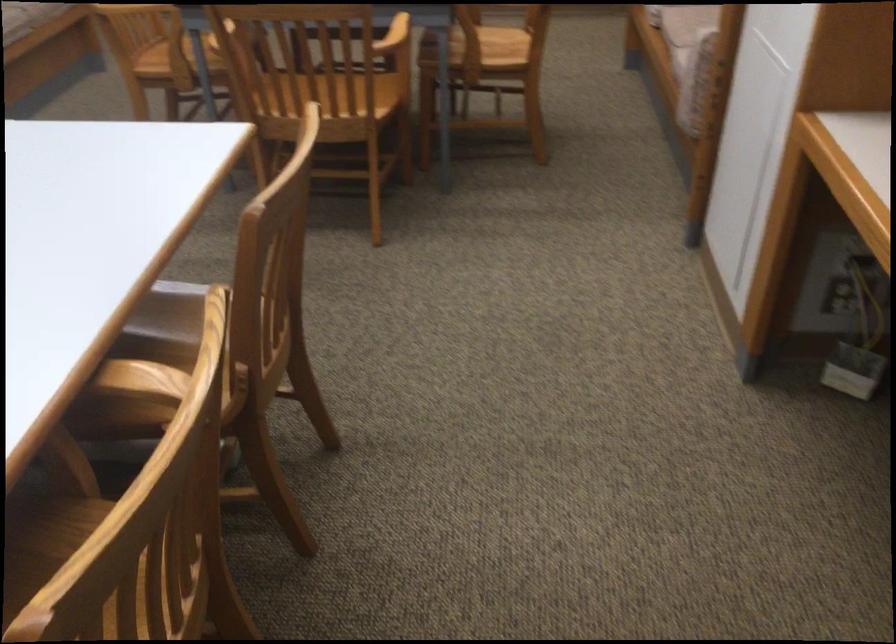
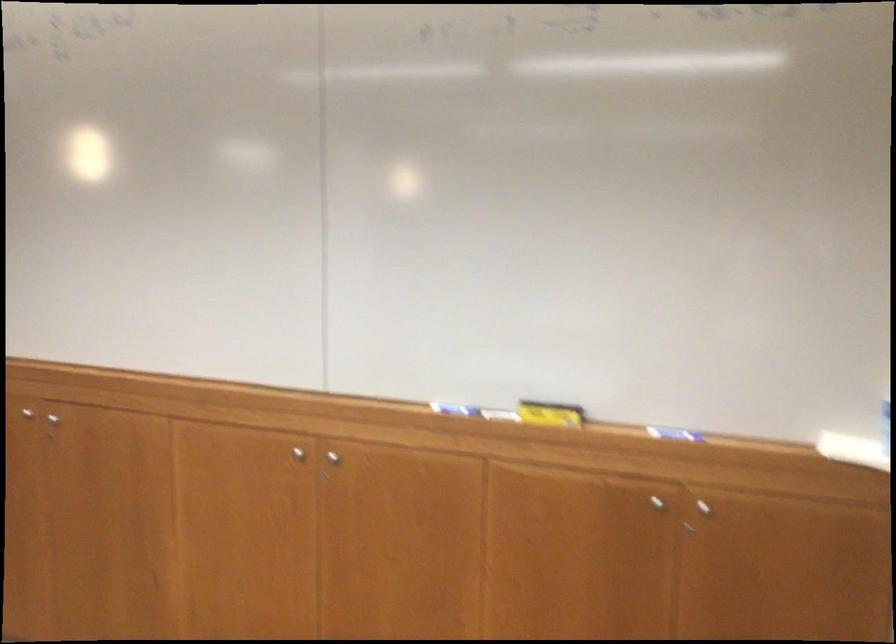
Question: The images are taken continuously from a first-person perspective. In which direction are you moving?

Choices:
 (A) Left
 (B) Right
 (C) Forward
 (D) Backward

Answer: (C)